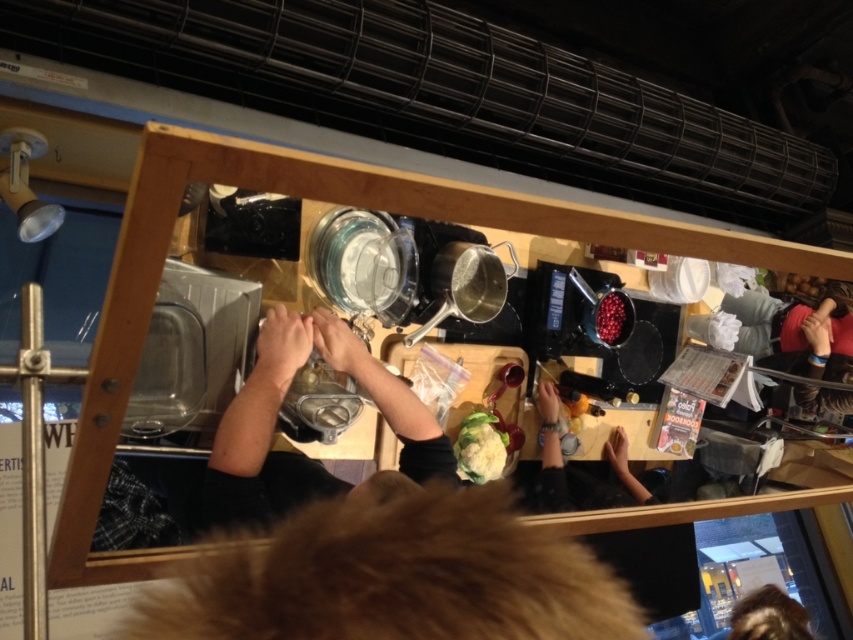
You are a chef standing at the kitchen counter and you need to grab an ingredient from the white textured cauliflower at center. However, there is someone with brown hair at lower right in your way. Which direction should you move to avoid them?

Since the brown hair at lower right is to the right of the white textured cauliflower at center, you should move to the left to avoid the person with brown hair at lower right and reach the cauliflower.

You are a chef observing a kitchen scene from above. You notice two brown elements in the image. One is the brown fur at center and the other is the brown hair at lower right. Which of these two elements is bigger in size?

The brown fur at center is larger in size than the brown hair at lower right.